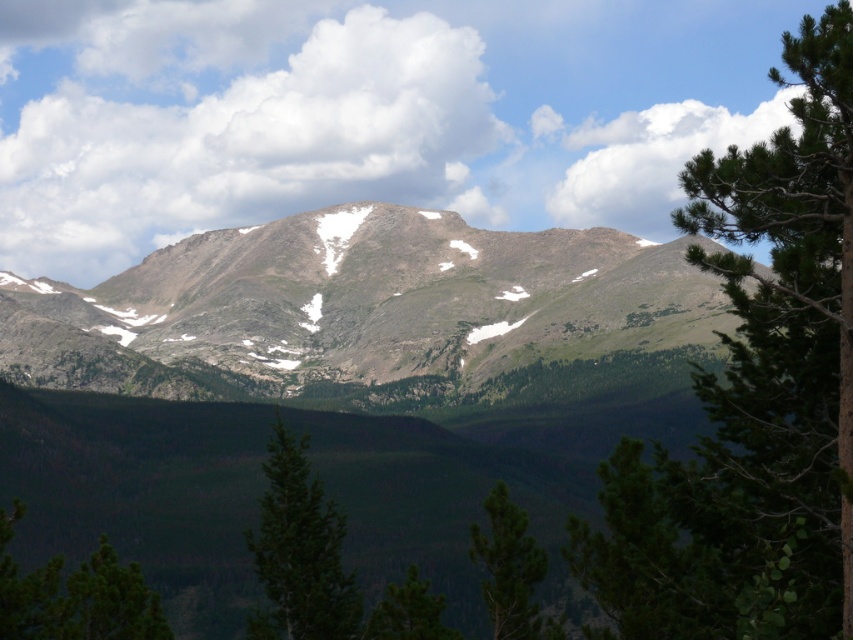
You are planning a hiking route through the mountainous landscape. You need to pass between the green matte tree at center and the green matte tree at lower center. Which direction should you head to move from the higher tree to the lower one?

The green matte tree at center is located above the green matte tree at lower center, so you should head downward to move from the higher tree to the lower one.

You are standing at the base of the mountain and see a point marked at coordinates (753, 397). According to the image, what does this point represent?

The point at (753, 397) indicates a green leafy tree at right.

You are a hiker trying to navigate through the forest. You see a green matte tree at center and a green matte tree at lower center. Which tree is closer to you?

The green matte tree at center is closer to you because the green matte tree at lower center is behind it.